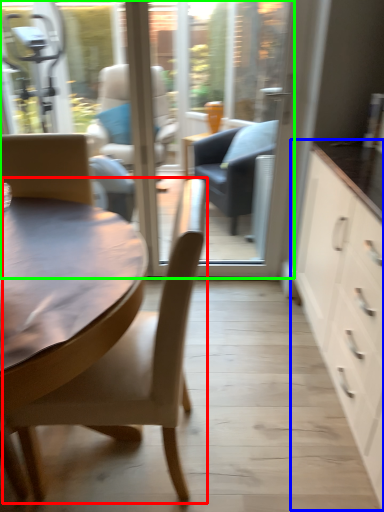
Question: Which object is positioned closest to chair (highlighted by a red box)? Select from cabinetry (highlighted by a blue box) and window screen (highlighted by a green box).

Choices:
 (A) cabinetry
 (B) window screen

Answer: (A)